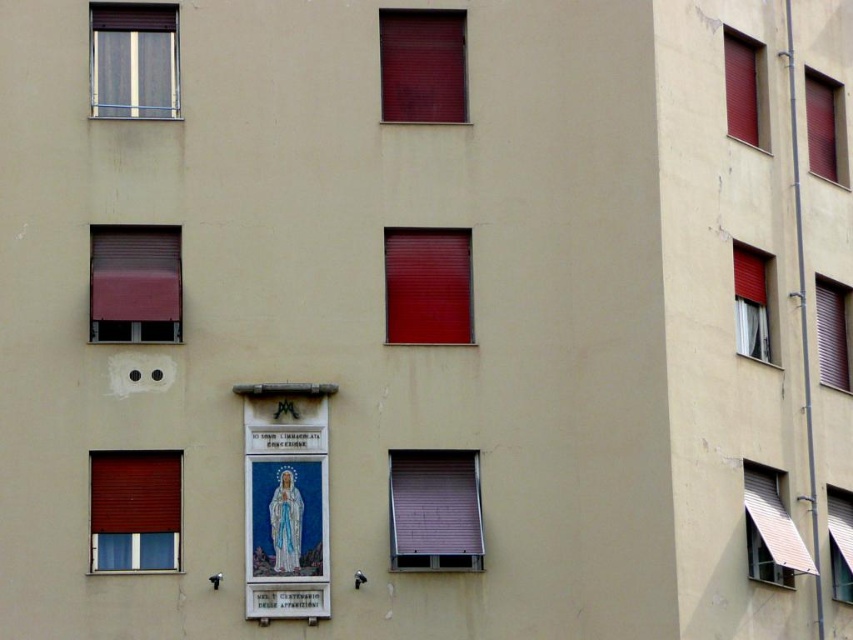
Question: Is matte glass window at upper left thinner than white fabric awning at lower right?

Choices:
 (A) no
 (B) yes

Answer: (A)

Question: Which object is farther from the camera taking this photo?

Choices:
 (A) purple fabric window at center
 (B) matte red roller at upper center

Answer: (B)

Question: Which point is closer to the camera?

Choices:
 (A) (729, 115)
 (B) (828, 544)
 (C) (831, 145)
 (D) (802, 572)

Answer: (D)

Question: Based on their relative distances, which object is farther from the matte red roller at upper center?

Choices:
 (A) white plastic window at lower right
 (B) matte red window at center
 (C) matte red window at upper right

Answer: (A)

Question: In this image, where is purple fabric window at center located relative to white plastic window at lower right?

Choices:
 (A) below
 (B) above

Answer: (B)

Question: Does matte red roller shutter at upper right appear under metallic silver window at right?

Choices:
 (A) yes
 (B) no

Answer: (B)